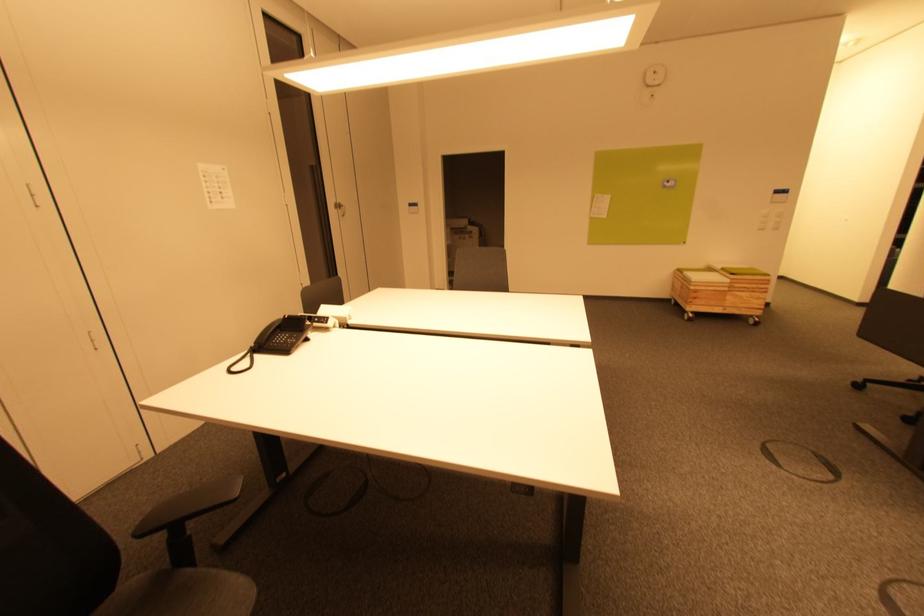
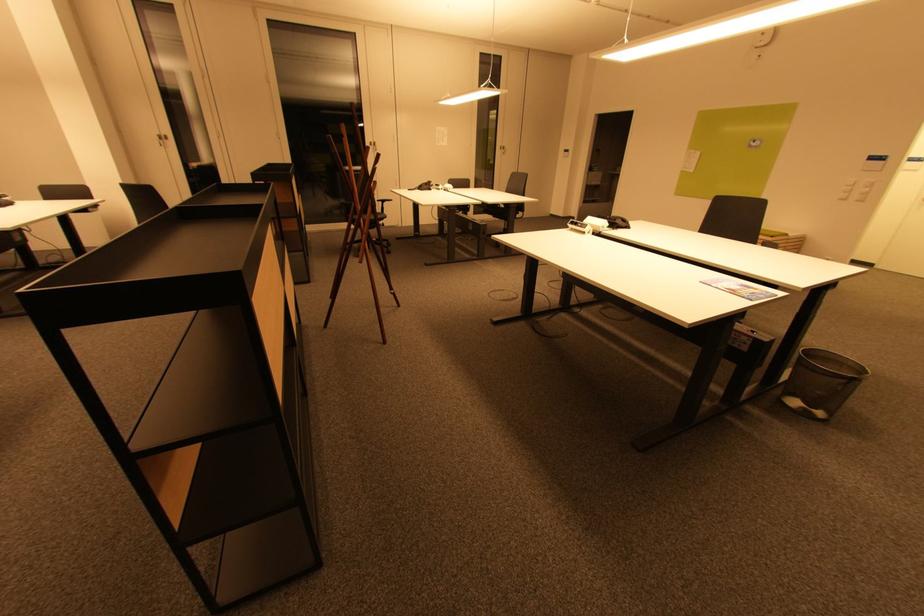
The point at (208,168) is marked in the first image. Where is the corresponding point in the second image?

(442, 130)